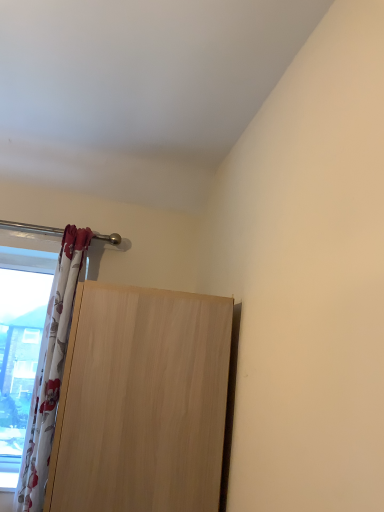
The width and height of the screenshot is (384, 512). Describe the element at coordinates (142, 402) in the screenshot. I see `light wood door at lower left` at that location.

Where is `light wood door at lower left`? light wood door at lower left is located at coordinates (142, 402).

Consider the image. Measure the distance between white floral fabric curtain at left and camera.

white floral fabric curtain at left is 5.06 feet away from camera.

The height and width of the screenshot is (512, 384). Describe the element at coordinates (50, 370) in the screenshot. I see `white floral fabric curtain at left` at that location.

Where is `white floral fabric curtain at left`? The image size is (384, 512). white floral fabric curtain at left is located at coordinates (50, 370).

Identify the location of light wood door at lower left. (142, 402).

Is white floral fabric curtain at left at the right side of light wood door at lower left?

Incorrect, white floral fabric curtain at left is not on the right side of light wood door at lower left.

Considering the relative positions of white floral fabric curtain at left and light wood door at lower left in the image provided, is white floral fabric curtain at left in front of light wood door at lower left?

That is False.

Considering the points (79, 240) and (121, 414), which point is in front, point (79, 240) or point (121, 414)?

The point (121, 414) is closer to the camera.

From the image's perspective, is white floral fabric curtain at left below light wood door at lower left?

No, from the image's perspective, white floral fabric curtain at left is not beneath light wood door at lower left.

From a real-world perspective, between white floral fabric curtain at left and light wood door at lower left, who is vertically higher?

In real-world perspective, white floral fabric curtain at left is above.

Considering the sizes of objects white floral fabric curtain at left and light wood door at lower left in the image provided, who is thinner, white floral fabric curtain at left or light wood door at lower left?

white floral fabric curtain at left is thinner.

In terms of height, does white floral fabric curtain at left look taller or shorter compared to light wood door at lower left?

Considering their sizes, white floral fabric curtain at left has more height than light wood door at lower left.

Considering the sizes of objects white floral fabric curtain at left and light wood door at lower left in the image provided, who is smaller, white floral fabric curtain at left or light wood door at lower left?

Smaller between the two is white floral fabric curtain at left.

Is white floral fabric curtain at left spatially inside light wood door at lower left, or outside of it?

white floral fabric curtain at left is located beyond the bounds of light wood door at lower left.

Consider the image. Is white floral fabric curtain at left next to light wood door at lower left and touching it?

No, white floral fabric curtain at left is not with light wood door at lower left.

Is white floral fabric curtain at left positioned with its back to light wood door at lower left?

white floral fabric curtain at left is not turned away from light wood door at lower left.

How different are the orientations of white floral fabric curtain at left and light wood door at lower left in degrees?

90 degrees.

Measure the distance from white floral fabric curtain at left to light wood door at lower left.

A distance of 25.20 inches exists between white floral fabric curtain at left and light wood door at lower left.

In order to click on curtain that is above the light wood door at lower left (from the image's perspective) in this screenshot , I will do `click(50, 370)`.

Which object is positioned more to the right, light wood door at lower left or white floral fabric curtain at left?

light wood door at lower left is more to the right.

Looking at this image, considering their positions, is light wood door at lower left located in front of or behind white floral fabric curtain at left?

light wood door at lower left is in front of white floral fabric curtain at left.

Considering the points (72, 497) and (45, 359), which point is behind, point (72, 497) or point (45, 359)?

The point (45, 359) is farther from the camera.

From the image's perspective, is light wood door at lower left beneath white floral fabric curtain at left?

Correct, light wood door at lower left appears lower than white floral fabric curtain at left in the image.

From a real-world perspective, is light wood door at lower left above or below white floral fabric curtain at left?

light wood door at lower left is situated lower than white floral fabric curtain at left in the real world.

Considering the sizes of light wood door at lower left and white floral fabric curtain at left in the image, is light wood door at lower left wider or thinner than white floral fabric curtain at left?

Considering their sizes, light wood door at lower left looks broader than white floral fabric curtain at left.

Who is taller, light wood door at lower left or white floral fabric curtain at left?

Standing taller between the two is white floral fabric curtain at left.

Consider the image. Is light wood door at lower left bigger than white floral fabric curtain at left?

Indeed, light wood door at lower left has a larger size compared to white floral fabric curtain at left.

Consider the image. Can white floral fabric curtain at left be found inside light wood door at lower left?

No, white floral fabric curtain at left is located outside of light wood door at lower left.

Would you say light wood door at lower left is a long distance from white floral fabric curtain at left?

No, light wood door at lower left is not far away from white floral fabric curtain at left.

Could you tell me if light wood door at lower left is turned towards white floral fabric curtain at left?

Yes, light wood door at lower left faces towards white floral fabric curtain at left.

Locate an element on the screen. door below the white floral fabric curtain at left (from the image's perspective) is located at coordinates (142, 402).

Where is `door in front of the white floral fabric curtain at left`? door in front of the white floral fabric curtain at left is located at coordinates (142, 402).

You are a GUI agent. You are given a task and a screenshot of the screen. Output one action in this format:
    pyautogui.click(x=<x>, y=<y>)
    Task: Click on the curtain that appears behind the light wood door at lower left
    Image resolution: width=384 pixels, height=512 pixels.
    Given the screenshot: What is the action you would take?
    pyautogui.click(x=50, y=370)